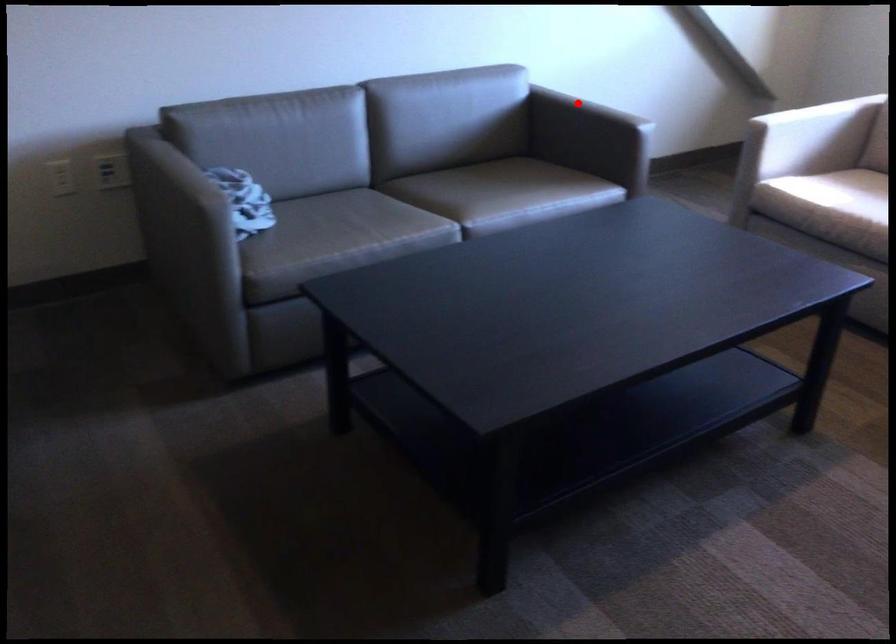
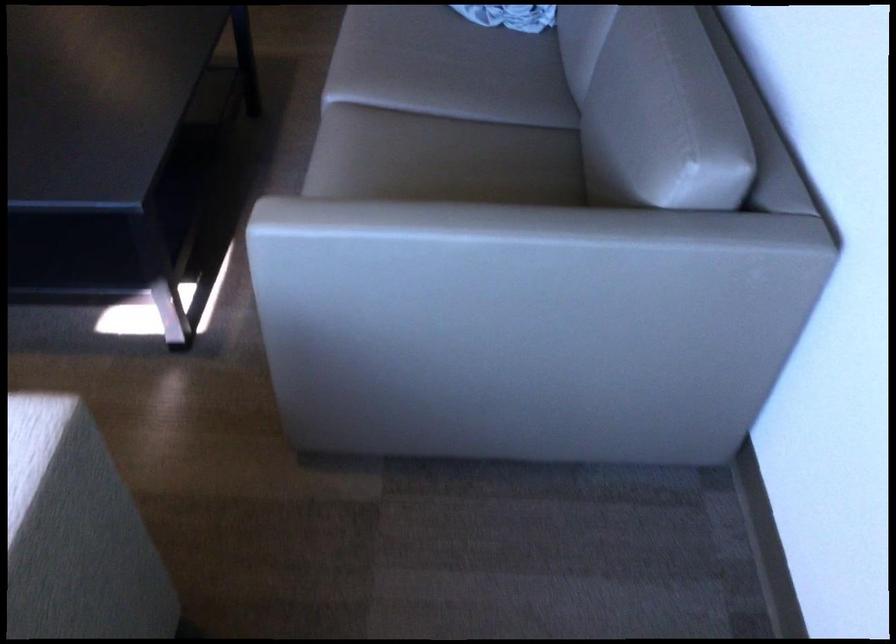
Locate, in the second image, the point that corresponds to the highlighted location in the first image.

(485, 249)